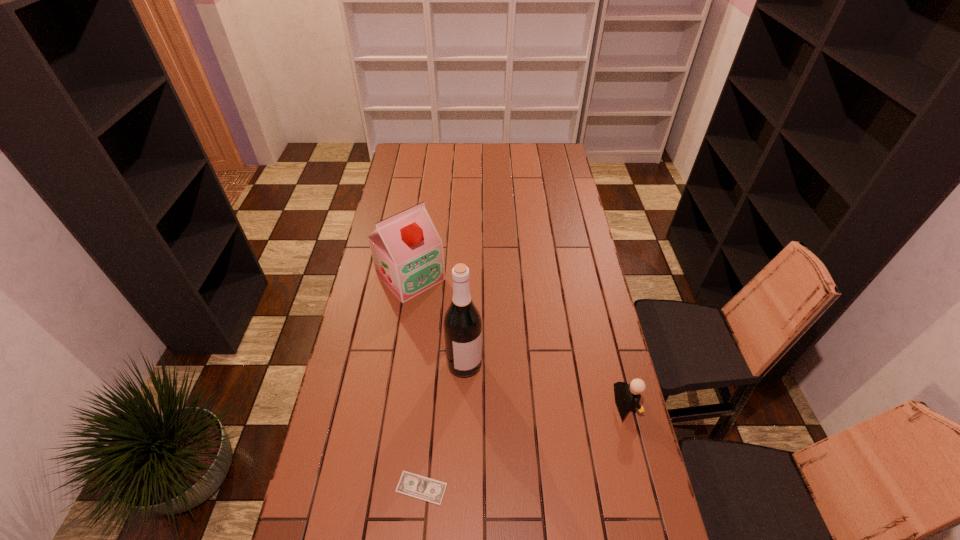
Locate an element on the screen. This screenshot has width=960, height=540. free space between the farthest object and the wine bottle is located at coordinates (438, 320).

The height and width of the screenshot is (540, 960). What are the coordinates of `vacant area that lies between the tallest object and the shortest object` in the screenshot? It's located at (443, 426).

Point out which object is positioned as the second nearest to the Lego. Please provide its 2D coordinates. Your answer should be formatted as a tuple, i.e. [(x, y)], where the tuple contains the x and y coordinates of a point satisfying the conditions above.

[(410, 484)]

Select which object is the third closest to the shortest object. Please provide its 2D coordinates. Your answer should be formatted as a tuple, i.e. [(x, y)], where the tuple contains the x and y coordinates of a point satisfying the conditions above.

[(407, 251)]

Identify the location of free point that satisfies the following two spatial constraints: 1. on the back side of the third tallest object; 2. on the front-facing side of the money. pos(429,404).

Find the location of a particular element. This screenshot has height=540, width=960. vacant space that satisfies the following two spatial constraints: 1. on the front side of the wine bottle; 2. on the right side of the farthest object is located at coordinates (397, 363).

This screenshot has height=540, width=960. In order to click on vacant region that satisfies the following two spatial constraints: 1. on the front side of the wine bottle; 2. on the left side of the soya milk in this screenshot , I will do `click(397, 363)`.

Find the location of `free space in the image that satisfies the following two spatial constraints: 1. on the back side of the wine bottle; 2. on the right side of the shortest object`. free space in the image that satisfies the following two spatial constraints: 1. on the back side of the wine bottle; 2. on the right side of the shortest object is located at coordinates (432, 363).